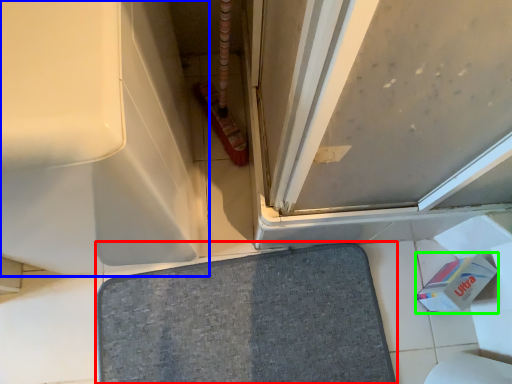
Question: Which object is the closest to the bath mat (highlighted by a red box)? Choose among these: bath (highlighted by a blue box) or toilet paper (highlighted by a green box).

Choices:
 (A) bath
 (B) toilet paper

Answer: (B)